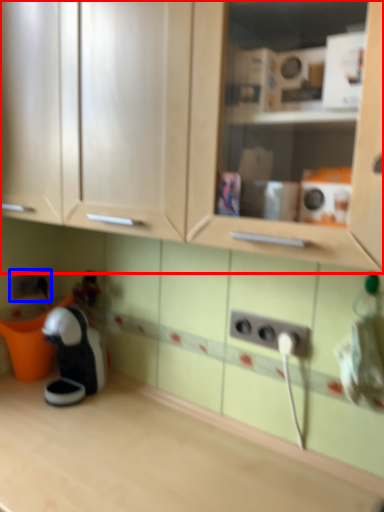
Question: Which point is closer to the camera, cabinetry (highlighted by a red box) or electric outlet (highlighted by a blue box)?

Choices:
 (A) cabinetry
 (B) electric outlet

Answer: (A)